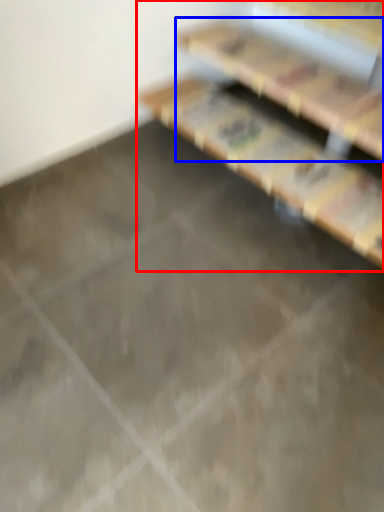
Question: Which object is further to the camera taking this photo, furniture (highlighted by a red box) or shelf (highlighted by a blue box)?

Choices:
 (A) furniture
 (B) shelf

Answer: (B)